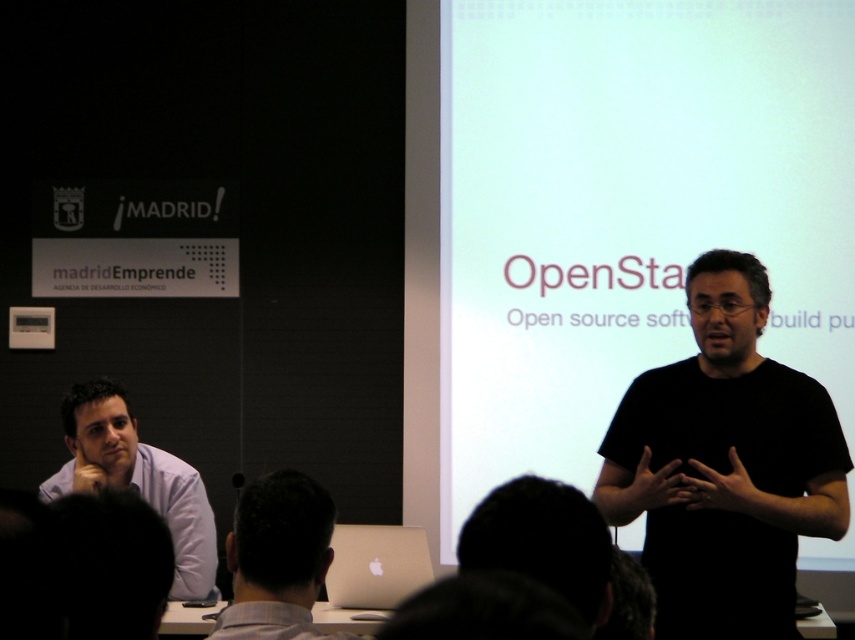
What do you see at coordinates (276, 560) in the screenshot? The width and height of the screenshot is (855, 640). I see `gray fabric shirt at lower left` at bounding box center [276, 560].

Find the location of a particular element. gray fabric shirt at lower left is located at coordinates (276, 560).

Can you confirm if gray fabric shirt at lower left is bigger than light blue shirt at left?

Incorrect, gray fabric shirt at lower left is not larger than light blue shirt at left.

What do you see at coordinates (276, 560) in the screenshot?
I see `gray fabric shirt at lower left` at bounding box center [276, 560].

Between point (299, 500) and point (133, 420), which one is positioned in front?

Positioned in front is point (299, 500).

This screenshot has height=640, width=855. Identify the location of gray fabric shirt at lower left. (276, 560).

Between point (685, 237) and point (346, 545), which one is positioned behind?

The point (685, 237) is behind.

Is point (665, 33) less distant than point (333, 602)?

No.

Identify the location of white matte projection screen at center. (628, 209).